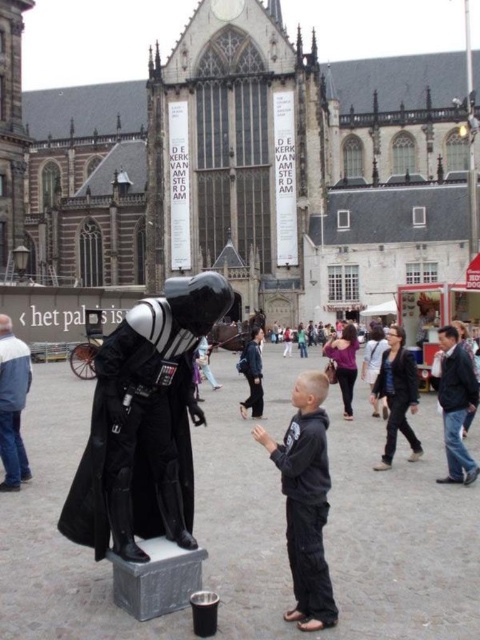
Does point (299, 378) come closer to viewer compared to point (442, 376)?

No.

Locate an element on the screen. dark gray hoodie at center is located at coordinates (305, 500).

Is point (142, 509) positioned after point (411, 401)?

No, it is not.

The image size is (480, 640). What do you see at coordinates (144, 422) in the screenshot? I see `shiny black armor at center` at bounding box center [144, 422].

Locate an element on the screen. Image resolution: width=480 pixels, height=640 pixels. shiny black armor at center is located at coordinates (144, 422).

Is dark blue jeans at lower right below dark gray suit at center?

Indeed, dark blue jeans at lower right is positioned under dark gray suit at center.

Which is above, dark blue jeans at lower right or dark gray suit at center?

dark gray suit at center

Is point (468, 358) farther from camera compared to point (31, 378)?

No, (468, 358) is in front of (31, 378).

The image size is (480, 640). I want to click on dark blue jeans at lower right, so click(456, 404).